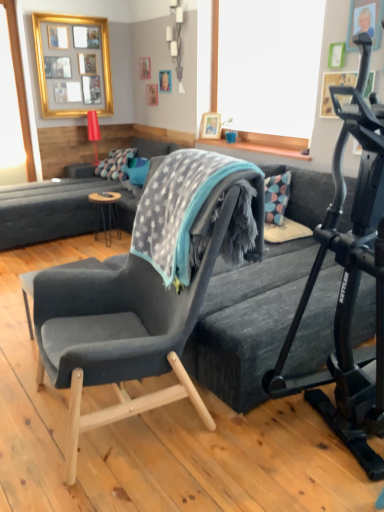
Question: Is multicolored fabric pillow at center, positioned as the second pillow in right-to-left order, positioned in front of gold metallic picture frame at upper left?

Choices:
 (A) yes
 (B) no

Answer: (B)

Question: Is multicolored fabric pillow at center, positioned as the 1th pillow in left-to-right order, thinner than gold metallic picture frame at upper left?

Choices:
 (A) no
 (B) yes

Answer: (A)

Question: Is multicolored fabric pillow at center, positioned as the 1th pillow in left-to-right order, oriented away from gold metallic picture frame at upper left?

Choices:
 (A) no
 (B) yes

Answer: (A)

Question: From the image's perspective, is multicolored fabric pillow at center, positioned as the 1th pillow in left-to-right order, over gold metallic picture frame at upper left?

Choices:
 (A) yes
 (B) no

Answer: (B)

Question: From the image's perspective, is multicolored fabric pillow at center, positioned as the 1th pillow in left-to-right order, below gold metallic picture frame at upper left?

Choices:
 (A) no
 (B) yes

Answer: (B)

Question: Considering the relative sizes of multicolored fabric pillow at center, positioned as the 1th pillow in left-to-right order, and gold metallic picture frame at upper left in the image provided, is multicolored fabric pillow at center, positioned as the 1th pillow in left-to-right order, wider than gold metallic picture frame at upper left?

Choices:
 (A) yes
 (B) no

Answer: (A)

Question: From the image's perspective, is wooden black table at center on top of velvet dark gray armchair at center?

Choices:
 (A) yes
 (B) no

Answer: (A)

Question: Would you say wooden black table at center contains velvet dark gray armchair at center?

Choices:
 (A) yes
 (B) no

Answer: (B)

Question: Is wooden black table at center completely or partially outside of velvet dark gray armchair at center?

Choices:
 (A) yes
 (B) no

Answer: (A)

Question: From a real-world perspective, is wooden black table at center positioned under velvet dark gray armchair at center based on gravity?

Choices:
 (A) yes
 (B) no

Answer: (A)

Question: Considering the relative sizes of wooden black table at center and velvet dark gray armchair at center in the image provided, is wooden black table at center taller than velvet dark gray armchair at center?

Choices:
 (A) no
 (B) yes

Answer: (A)

Question: Is wooden black table at center smaller than velvet dark gray armchair at center?

Choices:
 (A) no
 (B) yes

Answer: (B)

Question: From a real-world perspective, is gray fleece blanket at center physically below multicolored fabric pillow at center, positioned as the second pillow in right-to-left order?

Choices:
 (A) no
 (B) yes

Answer: (A)